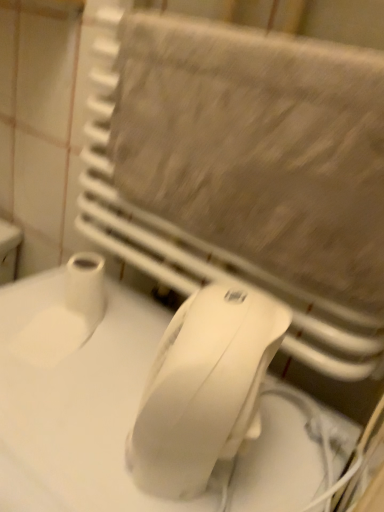
The width and height of the screenshot is (384, 512). In order to click on vacant area that lies between white plastic mouse at center and white matte toilet paper at lower left in this screenshot , I will do `click(95, 366)`.